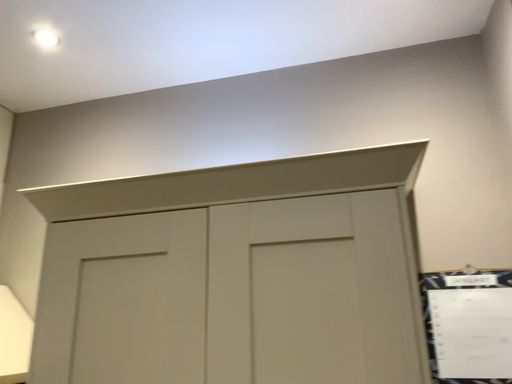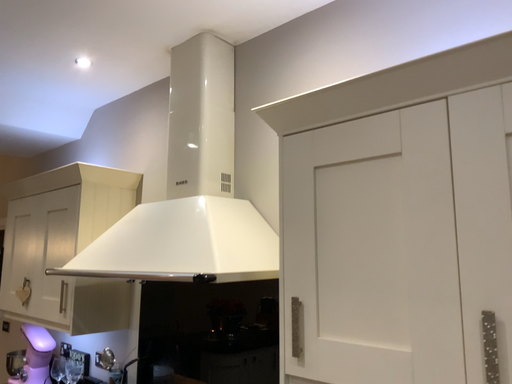
Question: Which way did the camera rotate in the video?

Choices:
 (A) rotated upward
 (B) rotated downward

Answer: (B)